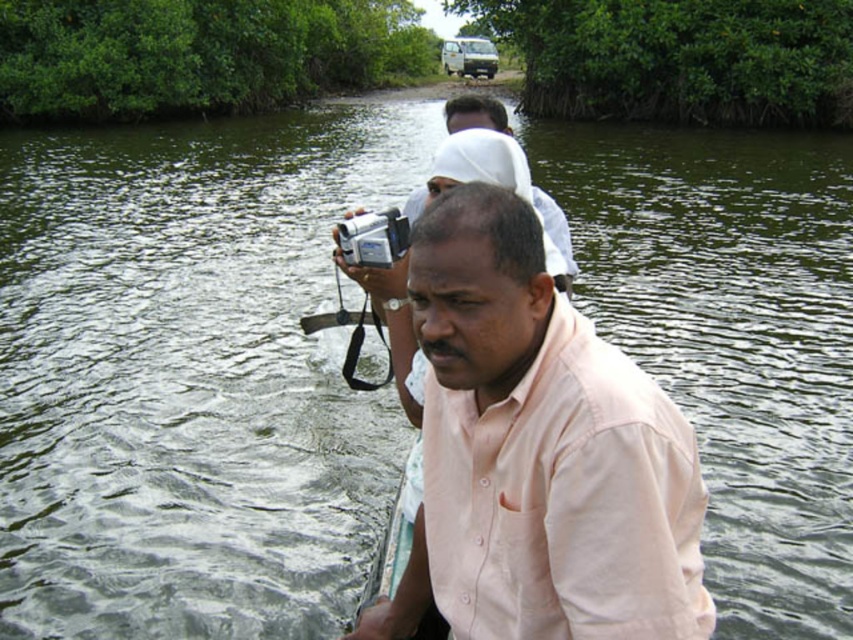
You are a photographer trying to capture a clear shot of the silver plastic camera at center. The person wearing the pink cotton shirt at center is blocking your view. Can you estimate whether the shirt is bigger or smaller than the camera?

The pink cotton shirt at center is larger in size than silver plastic camera at center, so the shirt is blocking the view of the camera because it is bigger.

You are a photographer trying to capture a wide shot of the mangrove forest. You notice the pink cotton shirt at center and the silver plastic camera at center in your frame. Which object should you adjust your focus on if you want to ensure the larger object is in sharp focus?

The pink cotton shirt at center is larger than the silver plastic camera at center, so you should focus on the pink cotton shirt at center to ensure the larger object is in sharp focus.